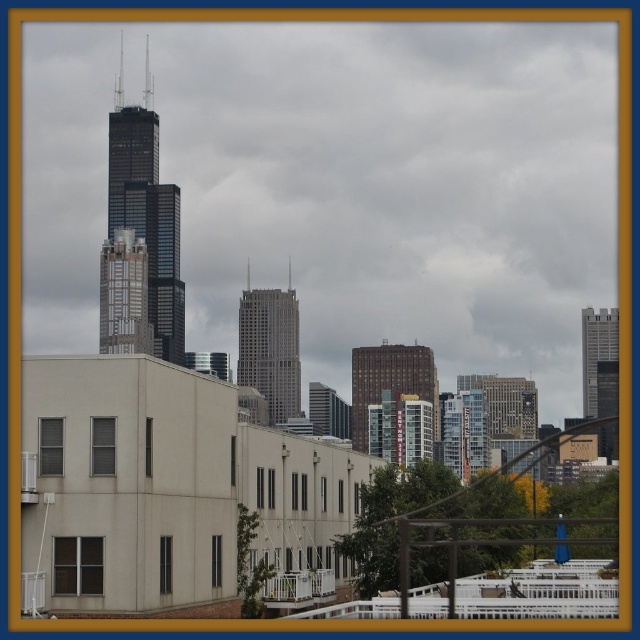
Question: Is black glass skyscraper at center positioned before brown brick building at center?

Choices:
 (A) no
 (B) yes

Answer: (A)

Question: Estimate the real-world distances between objects in this image. Which object is closer to the gray concrete skyscraper at right?

Choices:
 (A) brown brick building at center
 (B) gray glass skyscraper at center

Answer: (A)

Question: Can you confirm if black glass skyscraper at center is positioned to the left of gray glass skyscraper at center?

Choices:
 (A) no
 (B) yes

Answer: (B)

Question: Does black glass skyscraper at center have a greater width compared to gray concrete skyscraper at right?

Choices:
 (A) yes
 (B) no

Answer: (A)

Question: Which object is closer to the camera taking this photo?

Choices:
 (A) gray concrete skyscraper at right
 (B) black glass skyscraper at center
 (C) brown brick building at center
 (D) gray glass skyscraper at center

Answer: (D)

Question: Which point appears farthest from the camera in this image?

Choices:
 (A) (237, 324)
 (B) (388, 374)
 (C) (582, 339)
 (D) (140, 333)

Answer: (C)